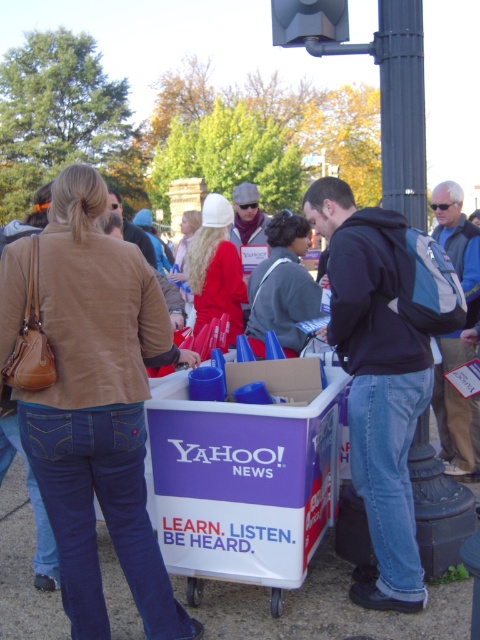
Question: Is purple cardboard cart at center positioned behind black matte backpack at center?

Choices:
 (A) no
 (B) yes

Answer: (A)

Question: Which point is farther from the camera taking this photo?

Choices:
 (A) (158, 582)
 (B) (345, 218)

Answer: (B)

Question: Which of the following is the closest to the observer?

Choices:
 (A) black matte backpack at center
 (B) purple cardboard cart at center

Answer: (B)

Question: Which point is closer to the camera taking this photo?

Choices:
 (A) tap(0, 397)
 (B) tap(354, 381)

Answer: (A)

Question: Is purple cardboard cart at center further to the viewer compared to black matte backpack at center?

Choices:
 (A) no
 (B) yes

Answer: (A)

Question: From the image, what is the correct spatial relationship of purple cardboard cart at center in relation to black matte backpack at center?

Choices:
 (A) left
 (B) right

Answer: (A)